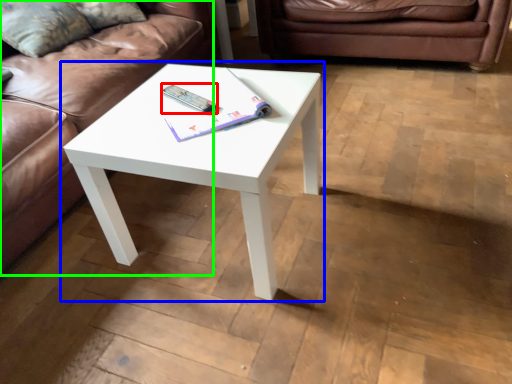
Question: Considering the real-world distances, which object is closest to remote (highlighted by a red box)? coffee table (highlighted by a blue box) or studio couch (highlighted by a green box).

Choices:
 (A) coffee table
 (B) studio couch

Answer: (A)